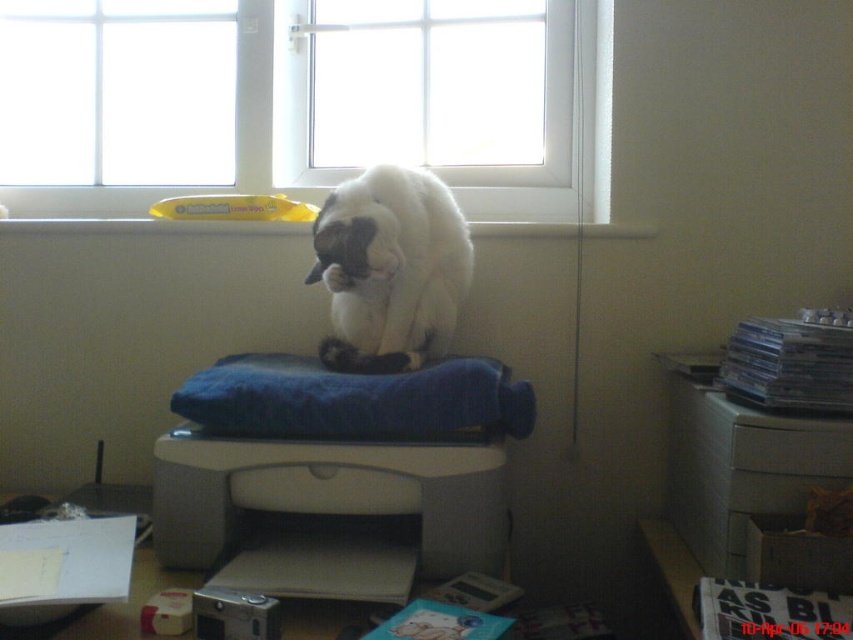
Question: Which point is closer to the camera?

Choices:
 (A) gray matte printer at center
 (B) transparent glass window at upper center
 (C) white fluffy cat at center

Answer: (A)

Question: From the image, what is the correct spatial relationship of gray matte printer at center in relation to transparent glass window at upper center?

Choices:
 (A) above
 (B) below

Answer: (B)

Question: Can you confirm if transparent glass window at upper center is positioned to the left of white fluffy cat at center?

Choices:
 (A) no
 (B) yes

Answer: (B)

Question: Based on their relative distances, which object is nearer to the white plastic window at upper center?

Choices:
 (A) transparent glass window at upper center
 (B) white plastic printer at lower right
 (C) white fluffy cat at center
 (D) gray matte printer at center

Answer: (C)

Question: Does transparent glass window at upper center appear under white plastic printer at lower right?

Choices:
 (A) no
 (B) yes

Answer: (A)

Question: Which object is farther from the camera taking this photo?

Choices:
 (A) transparent glass window at upper center
 (B) white plastic printer at lower right

Answer: (A)